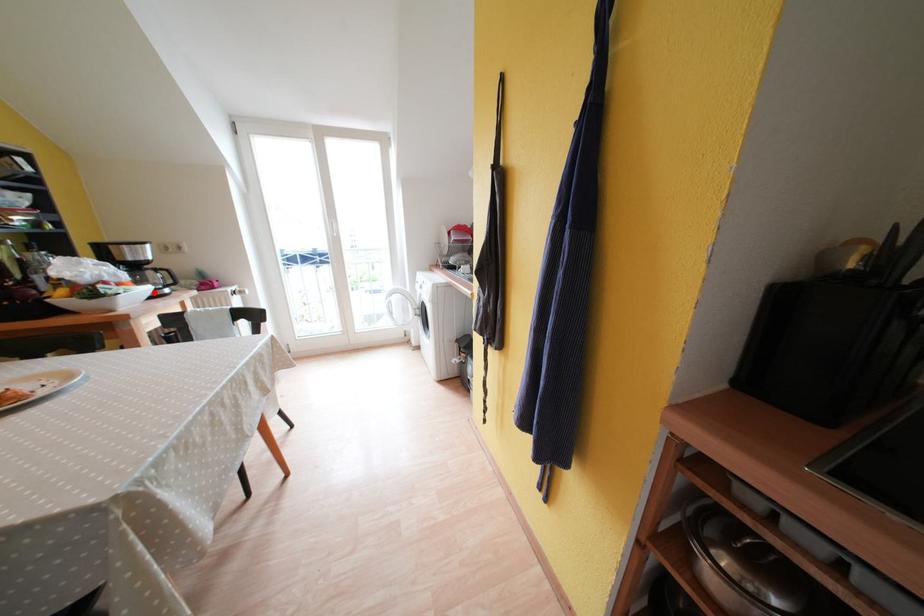
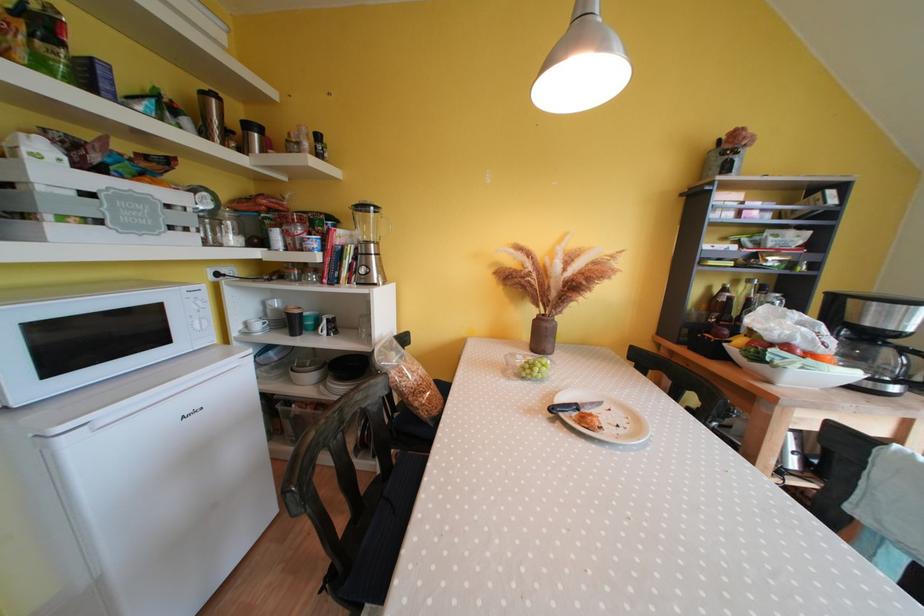
The point at the highlighted location is marked in the first image. Where is the corresponding point in the second image?

(858, 378)